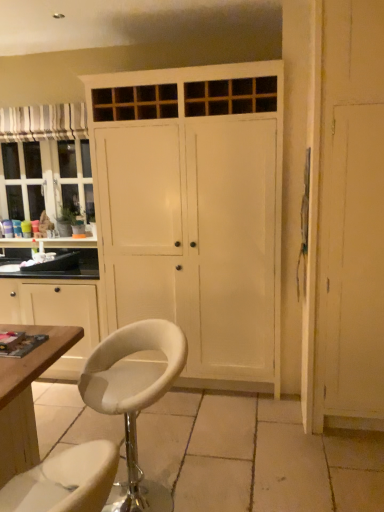
Locate an element on the screen. vacant space in front of wooden screen door at right is located at coordinates (342, 458).